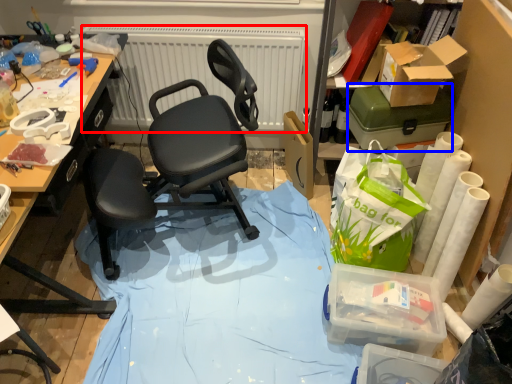
Question: Among these objects, which one is nearest to the camera, radiator (highlighted by a red box) or box (highlighted by a blue box)?

Choices:
 (A) radiator
 (B) box

Answer: (B)